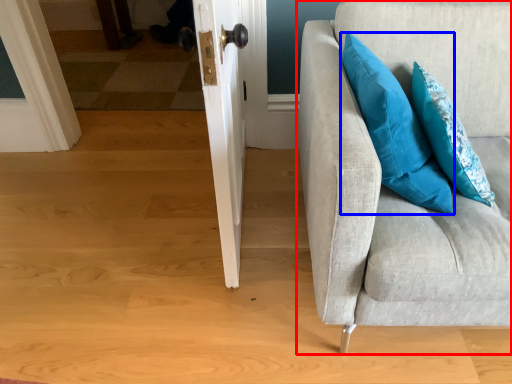
Question: Which point is closer to the camera, studio couch (highlighted by a red box) or pillow (highlighted by a blue box)?

Choices:
 (A) studio couch
 (B) pillow

Answer: (A)